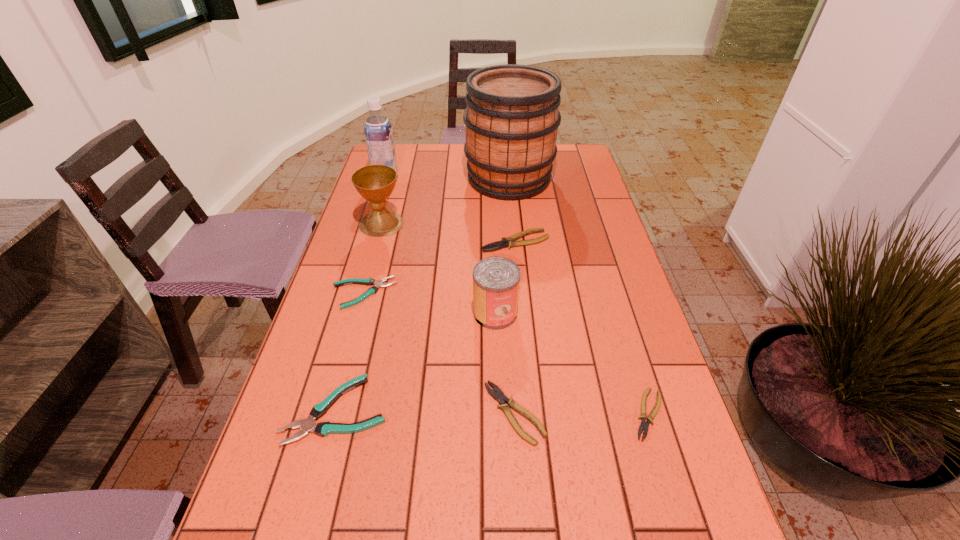
Find the location of a particular element. Image resolution: width=960 pixels, height=540 pixels. free spot located 0.200m on the front of the fourth nearest pliers is located at coordinates (341, 377).

At what (x,y) coordinates should I click in order to perform the action: click on free space located 0.350m on the left of the rightmost pliers. Please return your answer as a coordinate pair (x, y). The height and width of the screenshot is (540, 960). Looking at the image, I should click on (460, 414).

Identify the location of cider present at the far edge. The height and width of the screenshot is (540, 960). (512, 118).

Where is `soya milk that is at the far edge`? The height and width of the screenshot is (540, 960). soya milk that is at the far edge is located at coordinates (378, 132).

The image size is (960, 540). I want to click on soya milk present at the left edge, so click(378, 132).

Locate an element on the screen. chalice that is at the left edge is located at coordinates (375, 183).

The width and height of the screenshot is (960, 540). In order to click on cider that is positioned at the right edge in this screenshot , I will do `click(512, 118)`.

At what (x,y) coordinates should I click in order to perform the action: click on pliers that is at the right edge. Please return your answer as a coordinate pair (x, y). The image size is (960, 540). Looking at the image, I should click on (644, 425).

The width and height of the screenshot is (960, 540). Identify the location of object situated at the far left corner. (378, 132).

The image size is (960, 540). What are the coordinates of `object present at the far right corner` in the screenshot? It's located at (512, 118).